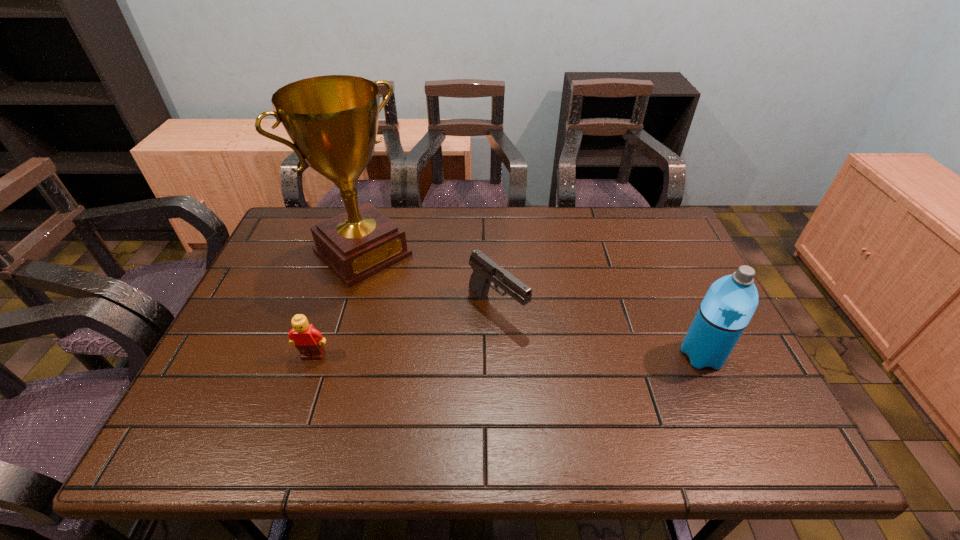
You are a GUI agent. You are given a task and a screenshot of the screen. Output one action in this format:
    pyautogui.click(x=<x>, y=<y>)
    Task: Click on the vacant spot on the desktop that is between the Lego and the second tallest object and is positioned on the plaque of the tallest object
    
    Given the screenshot: What is the action you would take?
    pyautogui.click(x=470, y=355)

The image size is (960, 540). I want to click on free spot on the desktop that is between the Lego and the thermos bottle and is positioned aim along the barrel of the pistol, so click(554, 355).